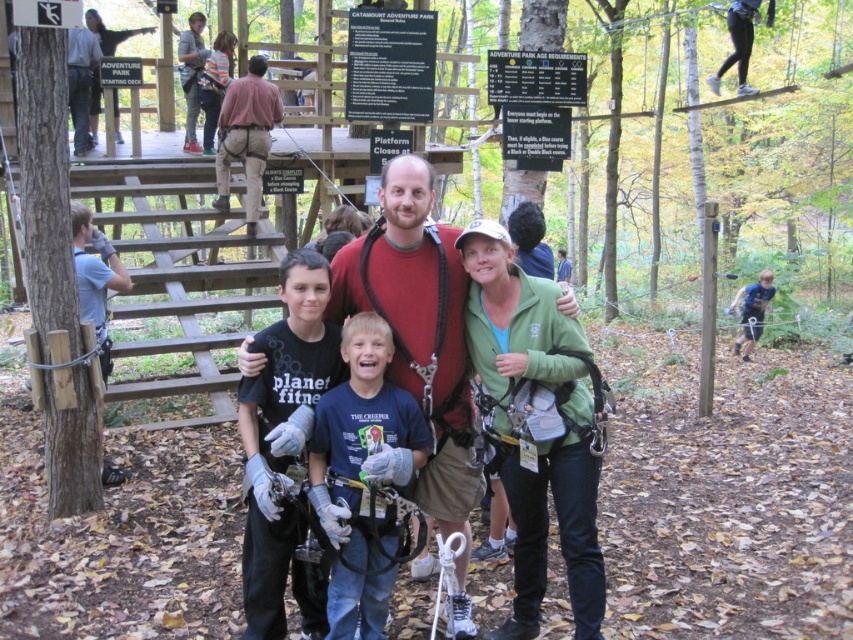
Please describe the position of the blue cotton shirt at center in terms of coordinates within the image frame. The image frame has its origin at the bottom left corner, with x increasing to the right and y increasing upward. Use the provided coordinates to answer.

The blue cotton shirt at center is located at coordinates approximately at point 0.744 on the x axis and 0.426 on the y axis within the image frame.

You are a photographer trying to capture a group photo of the adventurers. You notice the green softshell jacket at center and the matte red shirt at center. Which clothing item should you focus on first if you want to ensure both are in frame without moving the camera?

The green softshell jacket at center is to the right of the matte red shirt at center, so focusing on the matte red shirt at center first would allow you to frame both items since the green softshell jacket at center is positioned to its right.

You are a photographer trying to capture a group photo of the adventurers. The green softshell jacket at center and the matte red shirt at center are both in focus. Which clothing item appears narrower in the photo?

The green softshell jacket at center appears narrower because its width is less than the matte red shirt at center.